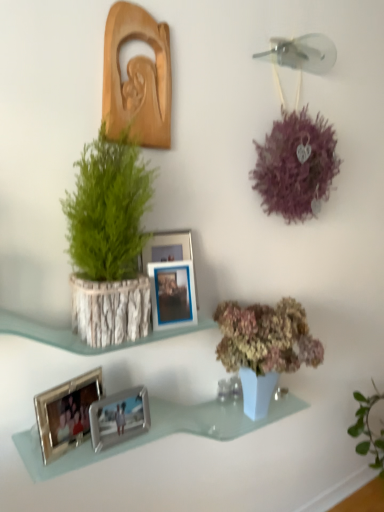
Describe the element at coordinates (109, 242) in the screenshot. I see `green leafy plant in bark pot at left` at that location.

Measure the distance between point (102, 141) and camera.

Point (102, 141) and camera are 1.16 meters apart from each other.

Measure the distance between wooden carving at upper left, the 5th picture frame in the bottom-to-top sequence, and camera.

They are 1.17 meters apart.

At what (x,y) coordinates should I click in order to perform the action: click on metallic silver photo frame at center, which appears as the second picture frame when viewed from the top. Please return your answer as a coordinate pair (x, y). Looking at the image, I should click on (168, 251).

Identify the location of blue metallic picture frame at center, which is the 3th picture frame in top-to-bottom order. (172, 294).

Can you confirm if silver metallic photo frames at lower left is shorter than blue metallic picture frame at center, which is the 3th picture frame in top-to-bottom order?

Yes, silver metallic photo frames at lower left is shorter than blue metallic picture frame at center, which is the 3th picture frame in top-to-bottom order.

Are silver metallic photo frames at lower left and blue metallic picture frame at center, the third picture frame when ordered from bottom to top, located far from each other?

That's not correct — silver metallic photo frames at lower left is a little close to blue metallic picture frame at center, the third picture frame when ordered from bottom to top.

From the picture: Can you confirm if silver metallic photo frames at lower left is positioned to the left of blue metallic picture frame at center, which is the 3th picture frame in top-to-bottom order?

Incorrect, silver metallic photo frames at lower left is not on the left side of blue metallic picture frame at center, which is the 3th picture frame in top-to-bottom order.

Is blue metallic picture frame at center, which is the 3th picture frame in top-to-bottom order, at the back of silver metallic photo frames at lower left?

silver metallic photo frames at lower left is not turned away from blue metallic picture frame at center, which is the 3th picture frame in top-to-bottom order.

Is wooden carving at upper left, the 5th picture frame in the bottom-to-top sequence, facing away from silver metallic photo frame at lower left, the second picture frame positioned from the bottom?

wooden carving at upper left, the 5th picture frame in the bottom-to-top sequence, does not have its back to silver metallic photo frame at lower left, the second picture frame positioned from the bottom.

Looking at this image, which object is wider, wooden carving at upper left, positioned as the 1th picture frame in top-to-bottom order, or silver metallic photo frame at lower left, the second picture frame positioned from the bottom?

Wider between the two is silver metallic photo frame at lower left, the second picture frame positioned from the bottom.

Based on the photo, is wooden carving at upper left, positioned as the 1th picture frame in top-to-bottom order, taller or shorter than silver metallic photo frame at lower left, the second picture frame positioned from the bottom?

wooden carving at upper left, positioned as the 1th picture frame in top-to-bottom order, is taller than silver metallic photo frame at lower left, the second picture frame positioned from the bottom.

Based on the photo, how many degrees apart are the facing directions of wooden carving at upper left, the 5th picture frame in the bottom-to-top sequence, and silver metallic photo frame at lower left, the second picture frame positioned from the bottom?

The facing directions of wooden carving at upper left, the 5th picture frame in the bottom-to-top sequence, and silver metallic photo frame at lower left, the second picture frame positioned from the bottom, are 26.6 degrees apart.

Considering the positions of objects silver metallic photo frame at lower center, marked as the 1th picture frame in a bottom-to-top arrangement, and metallic silver photo frame at center, which appears as the second picture frame when viewed from the top, in the image provided, who is more to the left, silver metallic photo frame at lower center, marked as the 1th picture frame in a bottom-to-top arrangement, or metallic silver photo frame at center, which appears as the second picture frame when viewed from the top,?

silver metallic photo frame at lower center, marked as the 1th picture frame in a bottom-to-top arrangement.

Is metallic silver photo frame at center, the fourth picture frame in the bottom-to-top sequence, completely or partially inside silver metallic photo frame at lower center, the 5th picture frame in the top-to-bottom sequence?

Actually, metallic silver photo frame at center, the fourth picture frame in the bottom-to-top sequence, is outside silver metallic photo frame at lower center, the 5th picture frame in the top-to-bottom sequence.

From the image's perspective, which is above, silver metallic photo frame at lower center, marked as the 1th picture frame in a bottom-to-top arrangement, or metallic silver photo frame at center, the fourth picture frame in the bottom-to-top sequence?

metallic silver photo frame at center, the fourth picture frame in the bottom-to-top sequence, is shown above in the image.

This screenshot has height=512, width=384. I want to click on the 3rd picture frame located beneath the metallic silver photo frame at center, which appears as the second picture frame when viewed from the top (from a real-world perspective), so click(x=119, y=417).

Which object is further away from the camera, silver metallic photo frame at lower left, the second picture frame positioned from the bottom, or blue metallic picture frame at center, the third picture frame when ordered from bottom to top?

blue metallic picture frame at center, the third picture frame when ordered from bottom to top, is further from the camera.

Does silver metallic photo frame at lower left, the second picture frame positioned from the bottom, appear on the right side of blue metallic picture frame at center, which is the 3th picture frame in top-to-bottom order?

No, silver metallic photo frame at lower left, the second picture frame positioned from the bottom, is not to the right of blue metallic picture frame at center, which is the 3th picture frame in top-to-bottom order.

Looking at this image, which point is more distant from viewer, (66, 398) or (175, 302)?

The point (175, 302) is farther.

From a real-world perspective, is silver metallic photo frame at lower left, which appears as the 4th picture frame when viewed from the top, over blue metallic picture frame at center, which is the 3th picture frame in top-to-bottom order?

Actually, silver metallic photo frame at lower left, which appears as the 4th picture frame when viewed from the top, is physically below blue metallic picture frame at center, which is the 3th picture frame in top-to-bottom order, in the real world.

From a real-world perspective, which picture frame is the 5th one above the silver metallic photo frames at lower left? Please provide its 2D coordinates.

[(137, 78)]

Which object is closer to the camera taking this photo, wooden carving at upper left, positioned as the 1th picture frame in top-to-bottom order, or silver metallic photo frames at lower left?

silver metallic photo frames at lower left is more forward.

Which of these two, wooden carving at upper left, the 5th picture frame in the bottom-to-top sequence, or silver metallic photo frames at lower left, stands taller?

With more height is wooden carving at upper left, the 5th picture frame in the bottom-to-top sequence.

Relative to green leafy plant in bark pot at left, is metallic silver photo frame at center, the fourth picture frame in the bottom-to-top sequence, in front or behind?

metallic silver photo frame at center, the fourth picture frame in the bottom-to-top sequence, is positioned farther from the viewer than green leafy plant in bark pot at left.

From the image's perspective, is metallic silver photo frame at center, which appears as the second picture frame when viewed from the top, on top of green leafy plant in bark pot at left?

No, from the image's perspective, metallic silver photo frame at center, which appears as the second picture frame when viewed from the top, is not over green leafy plant in bark pot at left.

In the scene shown: Can you confirm if metallic silver photo frame at center, the fourth picture frame in the bottom-to-top sequence, is smaller than green leafy plant in bark pot at left?

Yes, metallic silver photo frame at center, the fourth picture frame in the bottom-to-top sequence, is smaller than green leafy plant in bark pot at left.

Which of these two, metallic silver photo frame at center, which appears as the second picture frame when viewed from the top, or green leafy plant in bark pot at left, stands shorter?

metallic silver photo frame at center, which appears as the second picture frame when viewed from the top.

Is metallic silver photo frame at center, the fourth picture frame in the bottom-to-top sequence, far away from wooden carving at upper left, positioned as the 1th picture frame in top-to-bottom order?

They are positioned close to each other.

Is metallic silver photo frame at center, which appears as the second picture frame when viewed from the top, facing towards wooden carving at upper left, the 5th picture frame in the bottom-to-top sequence?

No, metallic silver photo frame at center, which appears as the second picture frame when viewed from the top, is not oriented towards wooden carving at upper left, the 5th picture frame in the bottom-to-top sequence.

Is metallic silver photo frame at center, the fourth picture frame in the bottom-to-top sequence, thinner than wooden carving at upper left, positioned as the 1th picture frame in top-to-bottom order?

Incorrect, the width of metallic silver photo frame at center, the fourth picture frame in the bottom-to-top sequence, is not less than that of wooden carving at upper left, positioned as the 1th picture frame in top-to-bottom order.

What are the coordinates of `picture frame that is the 3rd one when counting upward from the silver metallic photo frames at lower left (from the image's perspective)` in the screenshot? It's located at (172, 294).

Identify the location of the 2nd picture frame to the right when counting from the silver metallic photo frame at lower left, the second picture frame positioned from the bottom. This screenshot has height=512, width=384. (137, 78).

Based on their spatial positions, is metallic silver photo frame at center, which appears as the second picture frame when viewed from the top, or silver metallic photo frames at lower left further from silver metallic photo frame at lower center, marked as the 1th picture frame in a bottom-to-top arrangement?

metallic silver photo frame at center, which appears as the second picture frame when viewed from the top, lies further to silver metallic photo frame at lower center, marked as the 1th picture frame in a bottom-to-top arrangement, than the other object.

Based on the photo, from the image, which object appears to be farther from wooden carving at upper left, positioned as the 1th picture frame in top-to-bottom order, silver metallic photo frames at lower left or silver metallic photo frame at lower center, the 5th picture frame in the top-to-bottom sequence?

silver metallic photo frames at lower left is further to wooden carving at upper left, positioned as the 1th picture frame in top-to-bottom order.

From the image, which object appears to be farther from silver metallic photo frame at lower center, the 5th picture frame in the top-to-bottom sequence, wooden carving at upper left, the 5th picture frame in the bottom-to-top sequence, or silver metallic photo frame at lower left, which appears as the 4th picture frame when viewed from the top?

Among the two, wooden carving at upper left, the 5th picture frame in the bottom-to-top sequence, is located further to silver metallic photo frame at lower center, the 5th picture frame in the top-to-bottom sequence.

Considering their positions, is silver metallic photo frame at lower center, marked as the 1th picture frame in a bottom-to-top arrangement, positioned closer to green leafy plant in bark pot at left than blue metallic picture frame at center, the third picture frame when ordered from bottom to top?

blue metallic picture frame at center, the third picture frame when ordered from bottom to top, lies closer to green leafy plant in bark pot at left than the other object.

Which object lies further to the anchor point silver metallic photo frame at lower center, the 5th picture frame in the top-to-bottom sequence, silver metallic photo frames at lower left or metallic silver photo frame at center, which appears as the second picture frame when viewed from the top?

metallic silver photo frame at center, which appears as the second picture frame when viewed from the top, lies further to silver metallic photo frame at lower center, the 5th picture frame in the top-to-bottom sequence, than the other object.

Which object lies nearer to the anchor point wooden carving at upper left, the 5th picture frame in the bottom-to-top sequence, silver metallic photo frames at lower left or green leafy plant in bark pot at left?

green leafy plant in bark pot at left lies closer to wooden carving at upper left, the 5th picture frame in the bottom-to-top sequence, than the other object.

From the image, which object appears to be farther from silver metallic photo frames at lower left, blue metallic picture frame at center, the third picture frame when ordered from bottom to top, or metallic silver photo frame at center, which appears as the second picture frame when viewed from the top?

metallic silver photo frame at center, which appears as the second picture frame when viewed from the top, lies further to silver metallic photo frames at lower left than the other object.

Looking at this image, estimate the real-world distances between objects in this image. Which object is further from silver metallic photo frame at lower left, the second picture frame positioned from the bottom, wooden carving at upper left, positioned as the 1th picture frame in top-to-bottom order, or silver metallic photo frame at lower center, marked as the 1th picture frame in a bottom-to-top arrangement?

The object further to silver metallic photo frame at lower left, the second picture frame positioned from the bottom, is wooden carving at upper left, positioned as the 1th picture frame in top-to-bottom order.

The width and height of the screenshot is (384, 512). Identify the location of houseplant between wooden carving at upper left, the 5th picture frame in the bottom-to-top sequence, and silver metallic photo frame at lower left, which appears as the 4th picture frame when viewed from the top, in the vertical direction. (109, 242).

Where is `picture frame between wooden carving at upper left, positioned as the 1th picture frame in top-to-bottom order, and blue metallic picture frame at center, the third picture frame when ordered from bottom to top, in the vertical direction`? This screenshot has width=384, height=512. picture frame between wooden carving at upper left, positioned as the 1th picture frame in top-to-bottom order, and blue metallic picture frame at center, the third picture frame when ordered from bottom to top, in the vertical direction is located at coordinates (168, 251).

The height and width of the screenshot is (512, 384). Identify the location of houseplant between wooden carving at upper left, the 5th picture frame in the bottom-to-top sequence, and blue metallic picture frame at center, which is the 3th picture frame in top-to-bottom order, in the up-down direction. (109, 242).

I want to click on houseplant between wooden carving at upper left, positioned as the 1th picture frame in top-to-bottom order, and metallic silver photo frame at center, which appears as the second picture frame when viewed from the top, in the up-down direction, so click(109, 242).